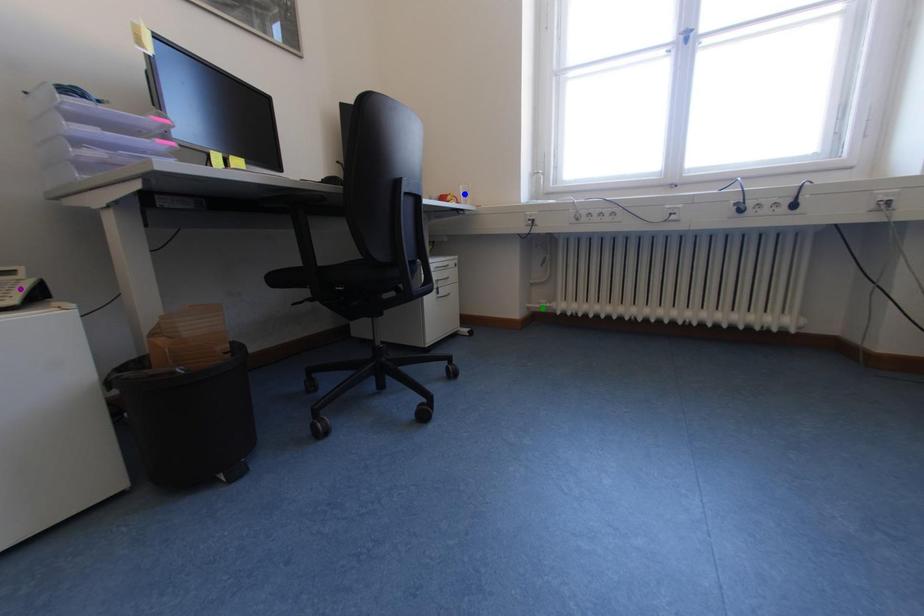
Order these from farthest to nearest:
purple point, green point, blue point

green point → blue point → purple point